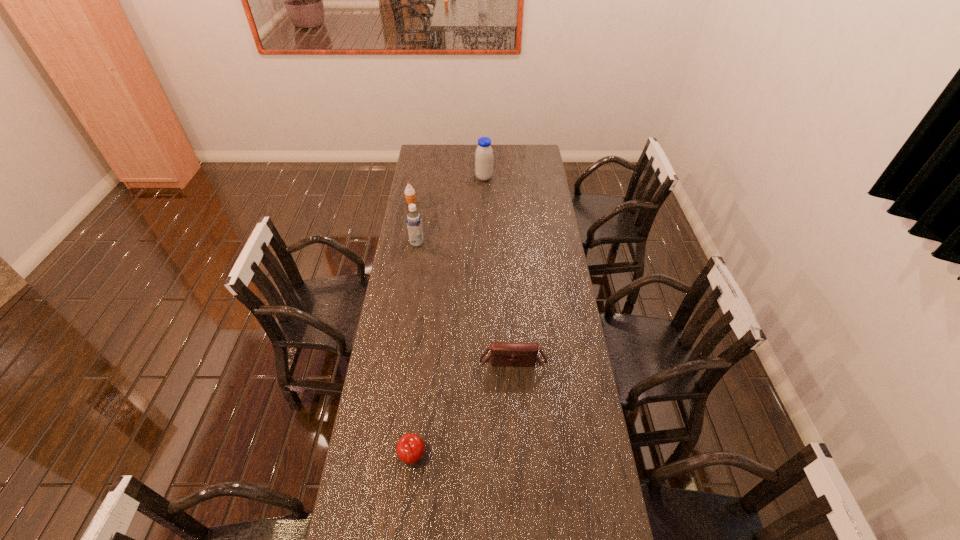
The image size is (960, 540). In order to click on the farthest object in this screenshot , I will do `click(484, 154)`.

The width and height of the screenshot is (960, 540). In order to click on the right soya milk in this screenshot , I will do `click(484, 154)`.

Image resolution: width=960 pixels, height=540 pixels. Find the location of `the left soya milk`. the left soya milk is located at coordinates (414, 223).

Where is `the nearer soya milk`? This screenshot has width=960, height=540. the nearer soya milk is located at coordinates (414, 223).

Find the location of a particular element. This screenshot has width=960, height=540. the second farthest object is located at coordinates coord(409,192).

Locate an element on the screen. The width and height of the screenshot is (960, 540). the fourth farthest object is located at coordinates (517, 354).

This screenshot has height=540, width=960. What are the coordinates of `the nearest object` in the screenshot? It's located at (410, 448).

At what (x,y) coordinates should I click in order to perform the action: click on the third object from left to right. Please return your answer as a coordinate pair (x, y). The width and height of the screenshot is (960, 540). Looking at the image, I should click on (410, 448).

The height and width of the screenshot is (540, 960). What are the coordinates of `free space located 0.350m on the front of the right soya milk` in the screenshot? It's located at (485, 224).

This screenshot has width=960, height=540. In order to click on vacant area situated 0.400m on the label of the left soya milk in this screenshot , I will do `click(510, 242)`.